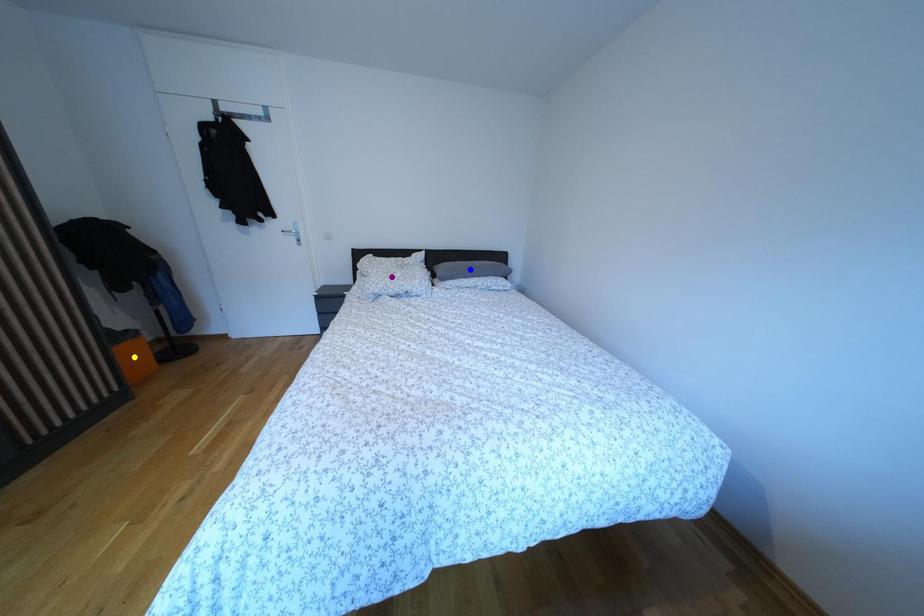
Order these from nearest to farthest:
yellow point
blue point
purple point

yellow point
purple point
blue point